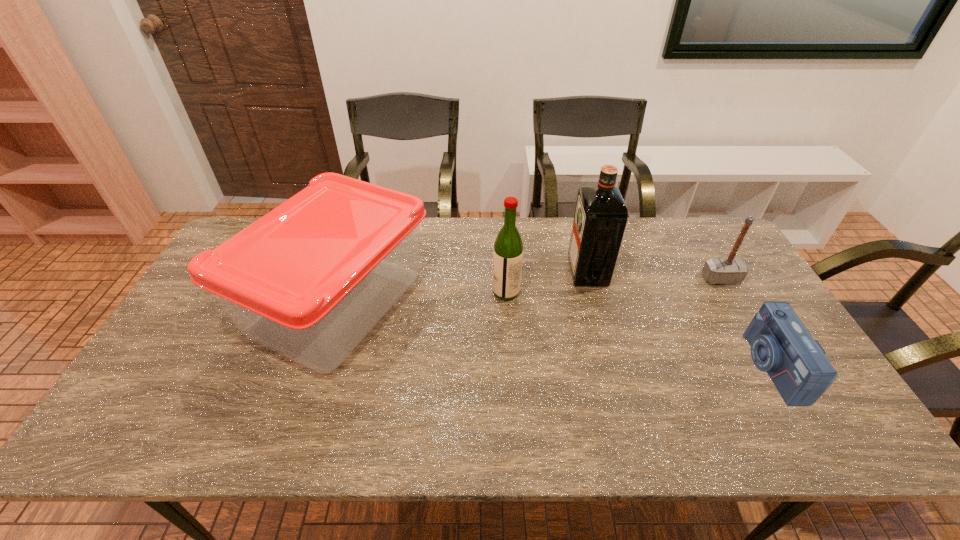
I want to click on free space located 0.370m on the label of the left liquor, so click(x=370, y=292).

Locate an element on the screen. This screenshot has height=540, width=960. vacant space positioned 0.090m on the back of the tray is located at coordinates (363, 224).

Find the location of `blank area located 0.200m on the striking surface of the fourth tallest object`. blank area located 0.200m on the striking surface of the fourth tallest object is located at coordinates pos(755,337).

Where is `vacant area located 0.370m on the lens of the shortest object`? Image resolution: width=960 pixels, height=540 pixels. vacant area located 0.370m on the lens of the shortest object is located at coordinates click(610, 366).

In order to click on free space located 0.180m on the lens of the shortest object in this screenshot , I will do `click(684, 366)`.

At what (x,y) coordinates should I click in order to perform the action: click on free space located on the lens of the shortest object. Please return your answer as a coordinate pair (x, y). Looking at the image, I should click on (621, 366).

Identify the location of liquor present at the far edge. Image resolution: width=960 pixels, height=540 pixels. (601, 215).

What are the coordinates of `tray situated at the far edge` in the screenshot? It's located at (310, 279).

Where is `object present at the left edge`? This screenshot has width=960, height=540. object present at the left edge is located at coordinates (310, 279).

Where is `hammer at the right edge`? The image size is (960, 540). hammer at the right edge is located at coordinates (730, 270).